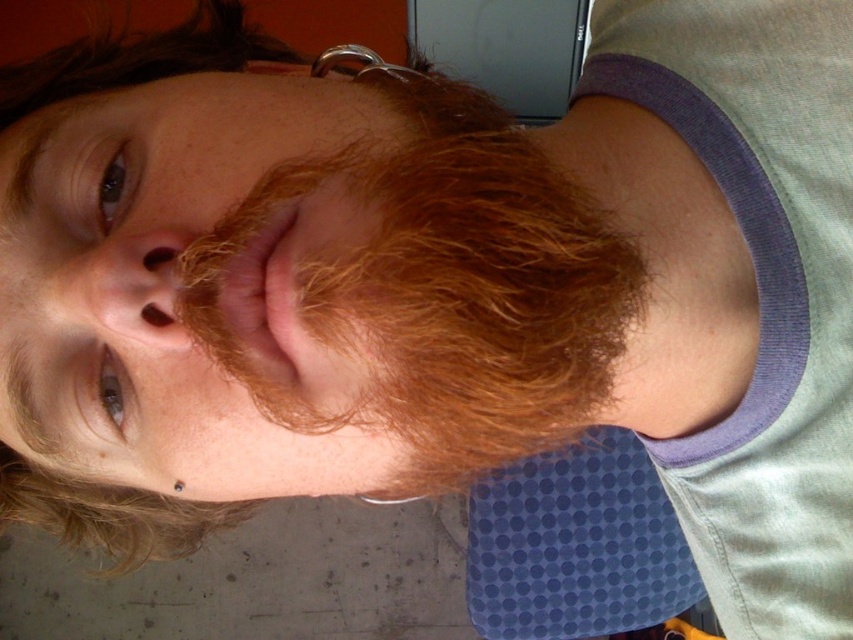
Find the location of a particular element. The width and height of the screenshot is (853, 640). fluffy reddish-brown beard at center is located at coordinates (434, 288).

Where is `fluffy reddish-brown beard at center`? fluffy reddish-brown beard at center is located at coordinates (434, 288).

The height and width of the screenshot is (640, 853). Identify the location of fluffy reddish-brown beard at center. (434, 288).